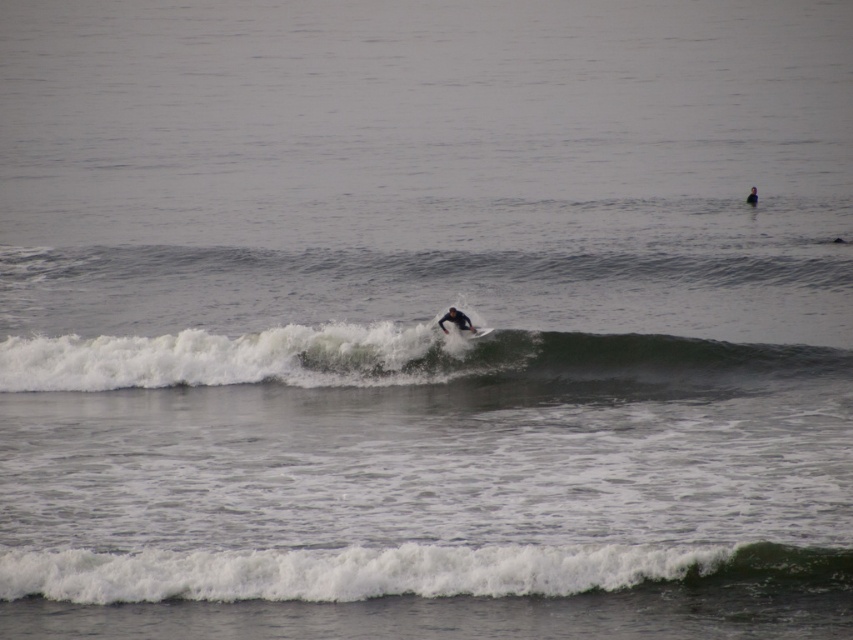
You are a photographer trying to capture the surfer in the center. The white foam wave at center and the black matte wetsuit at center are both in your frame. Which object is wider in the image?

The white foam wave at center is wider than the black matte wetsuit at center according to the description.

You are a photographer trying to capture the surfer in the center. You want to ensure the white foam wave at center and the black matte wetsuit at center are both visible in your shot. Based on their positions, which object should you focus on first to frame the scene properly?

Since the white foam wave at center is to the left of the black matte wetsuit at center, you should focus on the white foam wave at center first to ensure both objects are properly framed in the shot.